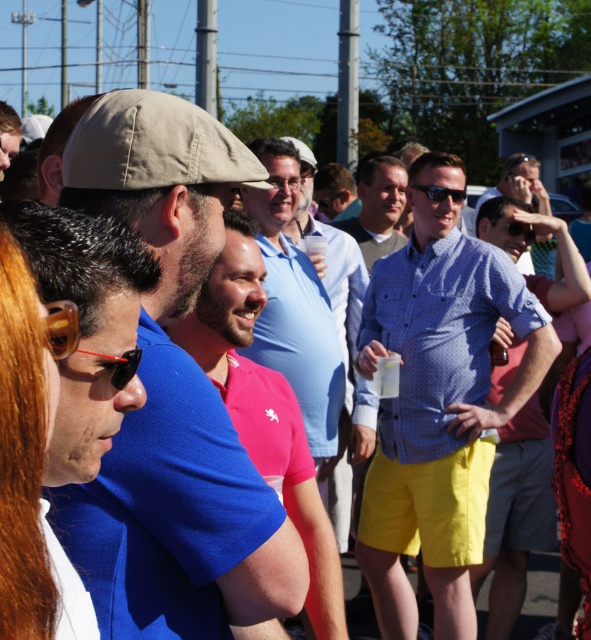
Question: Is khaki fabric cap at center further to the viewer compared to matte black sunglasses at center?

Choices:
 (A) yes
 (B) no

Answer: (B)

Question: Which point appears farthest from the camera in this image?

Choices:
 (A) (5, 112)
 (B) (482, 275)
 (C) (61, 328)
 (D) (441, 196)

Answer: (A)

Question: Is black plastic goggles at center wider than matte black sunglasses at center?

Choices:
 (A) no
 (B) yes

Answer: (A)

Question: Which object is positioned farthest from the blue dotted shirt at center?

Choices:
 (A) matte khaki cap at center
 (B) black plastic goggles at center
 (C) khaki fabric cap at center
 (D) matte black sunglasses at center

Answer: (B)

Question: Which object is farther from the camera taking this photo?

Choices:
 (A) black plastic goggles at center
 (B) blue dotted shirt at center

Answer: (B)

Question: Can you confirm if matte khaki cap at center is wider than matte black sunglasses at center?

Choices:
 (A) yes
 (B) no

Answer: (A)